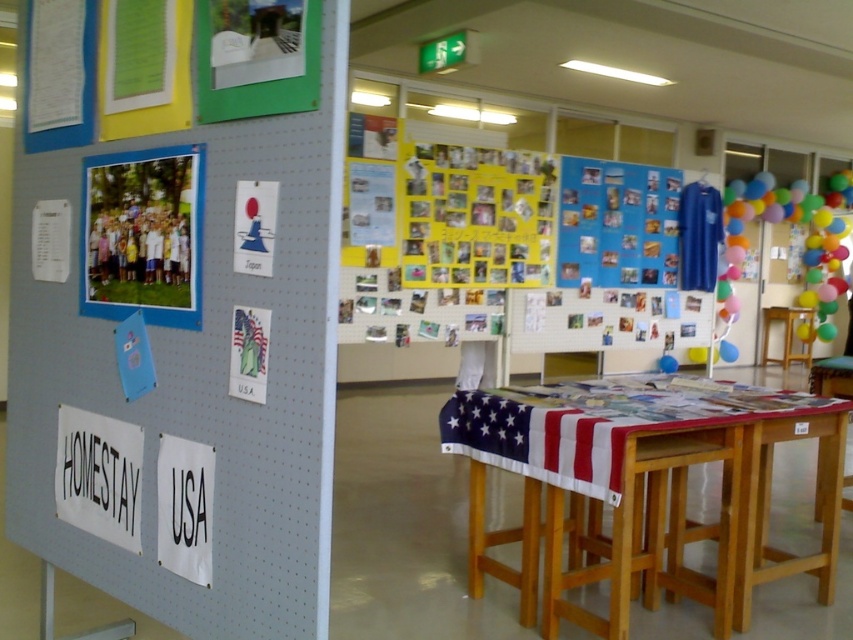
Between point (317, 493) and point (479, 252), which one is positioned behind?

Positioned behind is point (479, 252).

Can you confirm if white pegboard at left is thinner than yellow paper at upper center?

Indeed, white pegboard at left has a lesser width compared to yellow paper at upper center.

Between point (184, 445) and point (427, 225), which one is positioned in front?

Point (184, 445)

Locate an element on the screen. The width and height of the screenshot is (853, 640). white pegboard at left is located at coordinates (187, 388).

Between yellow paper at upper center and white paper at left, which one has less height?

white paper at left

Describe the element at coordinates (515, 257) in the screenshot. I see `yellow paper at upper center` at that location.

Where is `yellow paper at upper center`? yellow paper at upper center is located at coordinates (515, 257).

Which is in front, point (421, 192) or point (780, 314)?

Positioned in front is point (421, 192).

Which of these two, yellow paper at center or wooden bar stool at center, stands shorter?

wooden bar stool at center

The image size is (853, 640). What do you see at coordinates (476, 216) in the screenshot?
I see `yellow paper at center` at bounding box center [476, 216].

The height and width of the screenshot is (640, 853). I want to click on yellow paper at center, so click(476, 216).